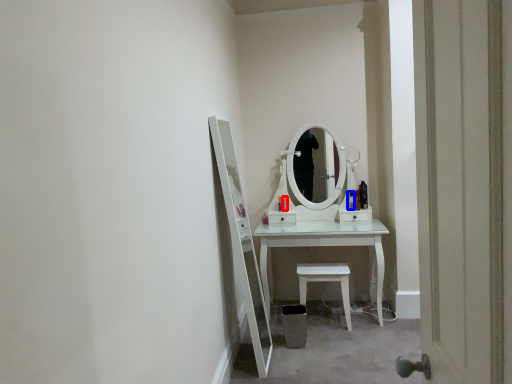
Question: Which point is further to the camera, toiletry (highlighted by a red box) or toiletry (highlighted by a blue box)?

Choices:
 (A) toiletry
 (B) toiletry

Answer: (A)